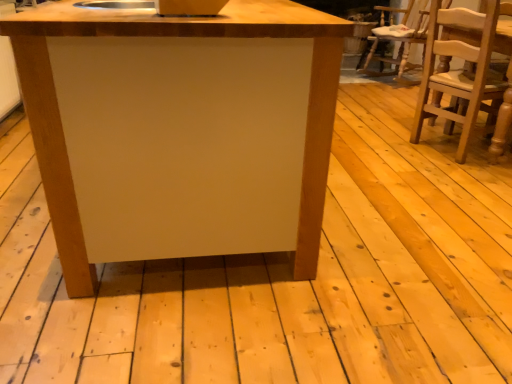
What are the coordinates of `free point in front of light brown wooden chair at right` in the screenshot? It's located at (459, 177).